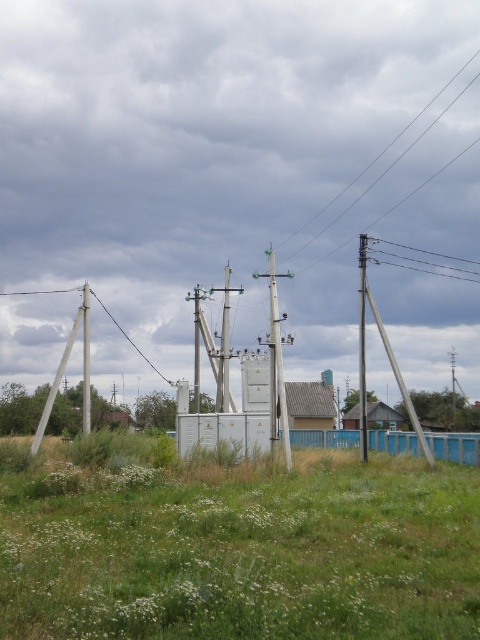
You are standing at the origin point of the image. Which direction should you move to reach the green grass at center?

The green grass at center is located at point (241,552), so you should move towards the right and slightly forward to reach it.

You are standing in the rural scene and want to take a photo of both the point at (412, 266) and the point at (310, 243). Which point should you focus on first to ensure both are in sharp focus?

You should focus on the point at (310, 243) first because it is closer to you than the point at (412, 266). By focusing on the closer point, the farther point will also be within the depth of field and in focus.